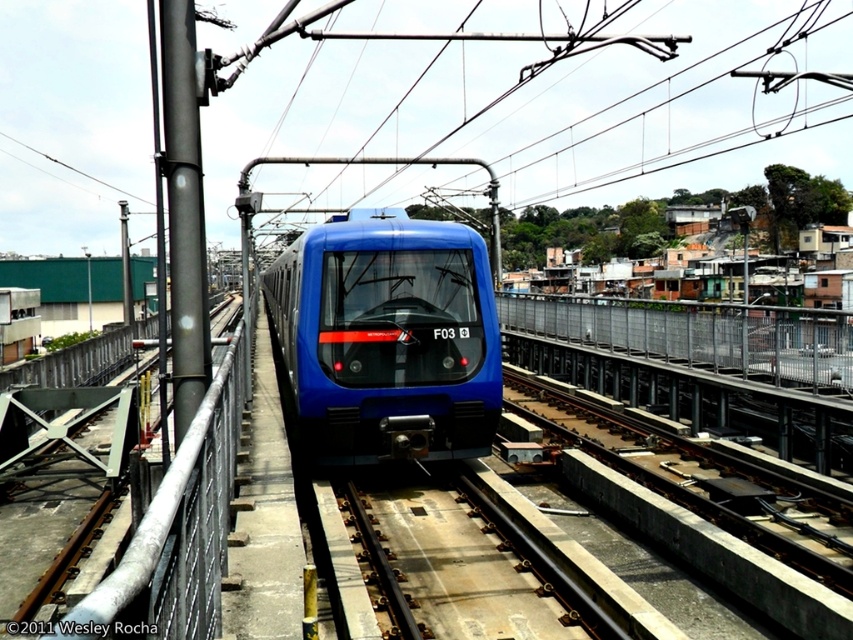
Question: Does blue glossy train at center come behind brown metallic train track at center?

Choices:
 (A) no
 (B) yes

Answer: (B)

Question: Is blue glossy train at center smaller than brown metallic train track at center?

Choices:
 (A) no
 (B) yes

Answer: (A)

Question: Which object appears farthest from the camera in this image?

Choices:
 (A) brown metallic train track at center
 (B) blue glossy train at center

Answer: (B)

Question: In this image, where is blue glossy train at center located relative to brown metallic train track at center?

Choices:
 (A) left
 (B) right

Answer: (A)